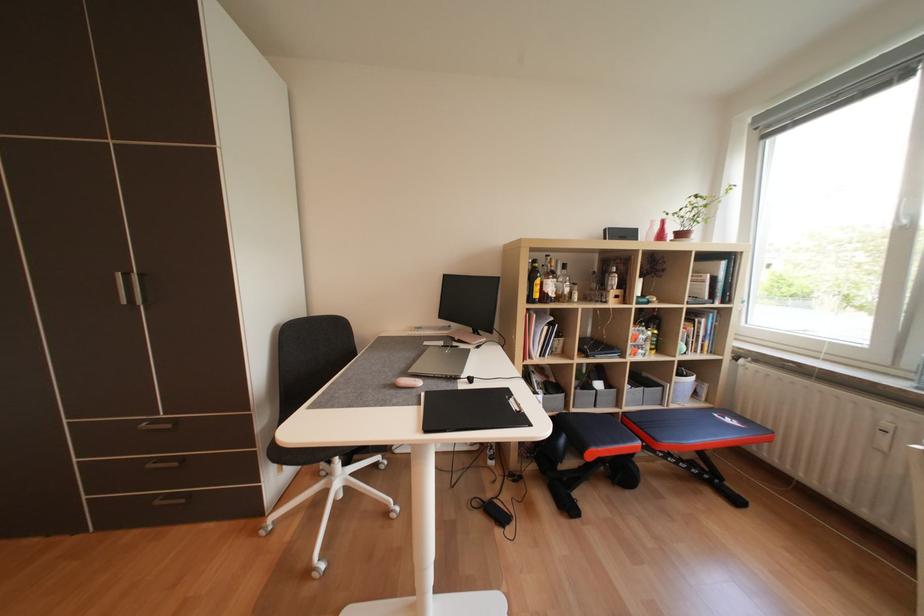
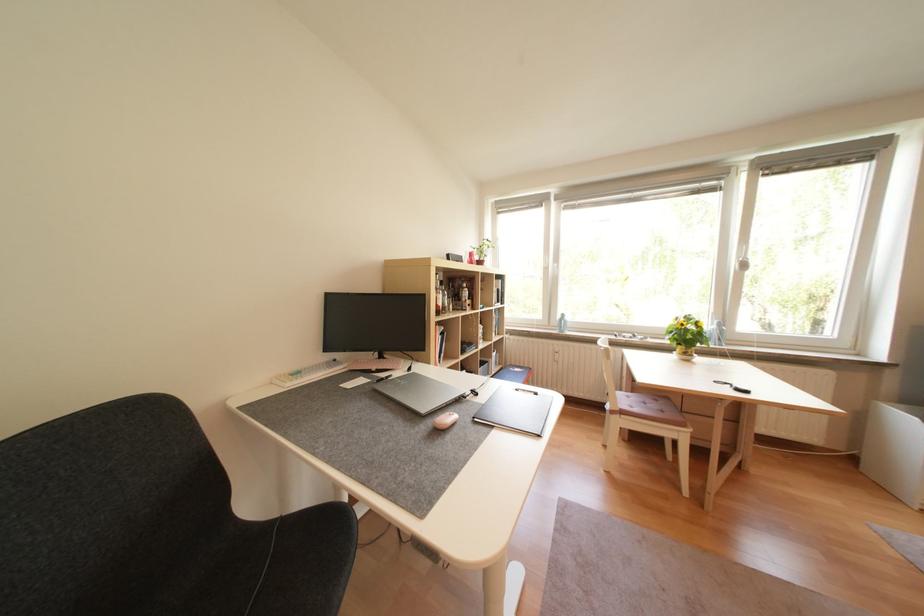
Question: The first image is from the beginning of the video and the second image is from the end. How did the camera likely rotate when shooting the video?

Choices:
 (A) Left
 (B) Right
 (C) Up
 (D) Down

Answer: (B)